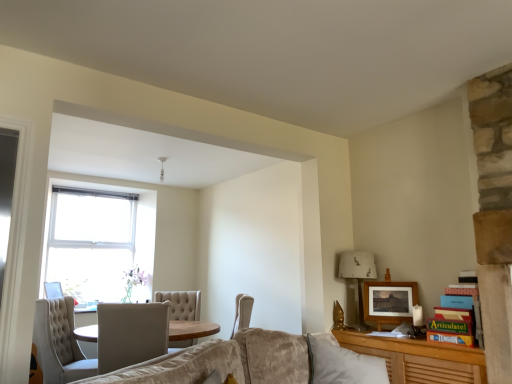
Question: Is wooden picture frame at lower left, positioned as the 1th picture frame in left-to-right order, not inside white tufted chair at center, marked as the 1th chair in a right-to-left arrangement?

Choices:
 (A) yes
 (B) no

Answer: (A)

Question: Can you confirm if wooden picture frame at lower left, marked as the second picture frame in a right-to-left arrangement, is thinner than white tufted chair at center, marked as the 1th chair in a right-to-left arrangement?

Choices:
 (A) yes
 (B) no

Answer: (A)

Question: Is wooden picture frame at lower left, which ranks as the 2th picture frame in front-to-back order, shorter than white tufted chair at center, which is counted as the second chair, starting from the left?

Choices:
 (A) yes
 (B) no

Answer: (A)

Question: Is wooden picture frame at lower left, the 1th picture frame from the bottom, to the right of white tufted chair at center, marked as the 1th chair in a right-to-left arrangement, from the viewer's perspective?

Choices:
 (A) no
 (B) yes

Answer: (A)

Question: Considering the relative positions of wooden picture frame at lower left, which ranks as the 2th picture frame in front-to-back order, and white tufted chair at center, which is counted as the second chair, starting from the left, in the image provided, is wooden picture frame at lower left, which ranks as the 2th picture frame in front-to-back order, to the left of white tufted chair at center, which is counted as the second chair, starting from the left, from the viewer's perspective?

Choices:
 (A) no
 (B) yes

Answer: (B)

Question: Looking at the image, does wooden picture frame at lower left, the first picture frame when ordered from back to front, seem bigger or smaller compared to white tufted chair at center, marked as the 1th chair in a right-to-left arrangement?

Choices:
 (A) small
 (B) big

Answer: (A)

Question: In terms of height, does wooden picture frame at lower left, the 1th picture frame from the bottom, look taller or shorter compared to white tufted chair at center, which is counted as the second chair, starting from the left?

Choices:
 (A) tall
 (B) short

Answer: (B)

Question: Is wooden picture frame at lower left, the 1th picture frame from the bottom, wider or thinner than white tufted chair at center, marked as the 1th chair in a right-to-left arrangement?

Choices:
 (A) wide
 (B) thin

Answer: (B)

Question: From a real-world perspective, relative to white tufted chair at center, marked as the 1th chair in a right-to-left arrangement, is wooden picture frame at lower left, marked as the second picture frame in a right-to-left arrangement, vertically above or below?

Choices:
 (A) above
 (B) below

Answer: (A)

Question: Based on their sizes in the image, would you say white fabric lampshade at right is bigger or smaller than matte wooden picture frame at upper right, which is the 1th picture frame in right-to-left order?

Choices:
 (A) big
 (B) small

Answer: (A)

Question: Looking at their shapes, would you say white fabric lampshade at right is wider or thinner than matte wooden picture frame at upper right, placed as the first picture frame when sorted from top to bottom?

Choices:
 (A) wide
 (B) thin

Answer: (A)

Question: From their relative heights in the image, would you say white fabric lampshade at right is taller or shorter than matte wooden picture frame at upper right, placed as the first picture frame when sorted from top to bottom?

Choices:
 (A) short
 (B) tall

Answer: (B)

Question: Based on their positions, is white fabric lampshade at right located to the left or right of matte wooden picture frame at upper right, placed as the first picture frame when sorted from top to bottom?

Choices:
 (A) right
 (B) left

Answer: (B)

Question: Considering the positions of white fabric lampshade at right and tufted fabric chair at lower left, the second chair viewed from the right, in the image, is white fabric lampshade at right taller or shorter than tufted fabric chair at lower left, the second chair viewed from the right,?

Choices:
 (A) tall
 (B) short

Answer: (B)

Question: Considering the positions of white fabric lampshade at right and tufted fabric chair at lower left, the second chair viewed from the right, in the image, is white fabric lampshade at right wider or thinner than tufted fabric chair at lower left, the second chair viewed from the right,?

Choices:
 (A) thin
 (B) wide

Answer: (A)